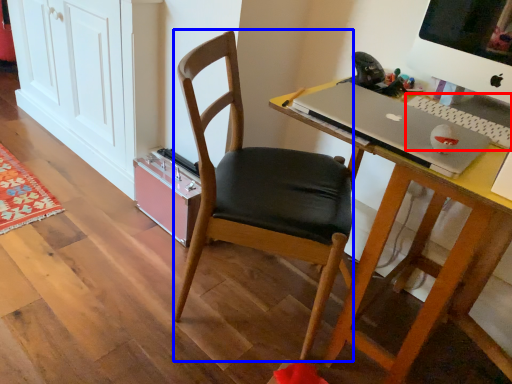
Question: Which object appears closest to the camera in this image, laptop keyboard (highlighted by a red box) or chair (highlighted by a blue box)?

Choices:
 (A) laptop keyboard
 (B) chair

Answer: (B)